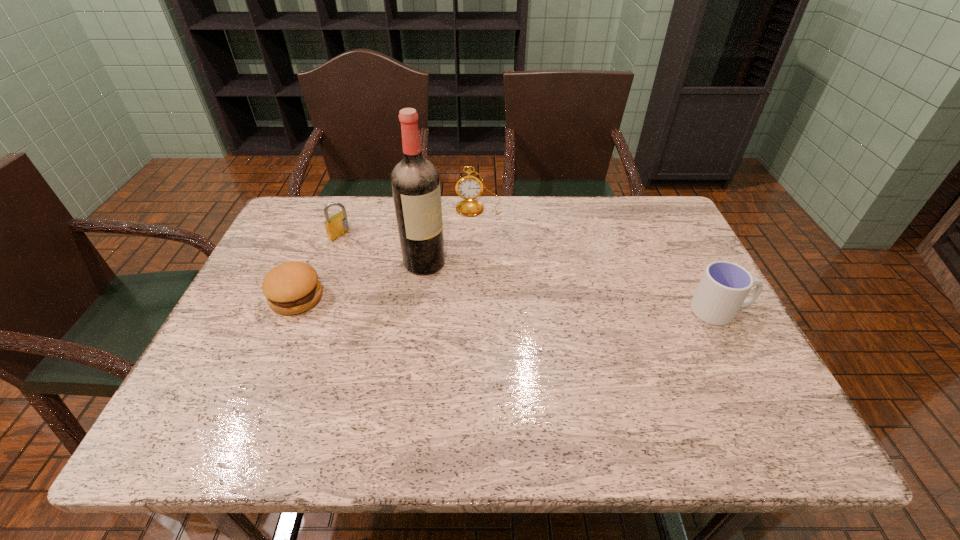
Find the location of `padlock located in the left edge section of the desktop`. padlock located in the left edge section of the desktop is located at coordinates click(337, 225).

Locate an element on the screen. The width and height of the screenshot is (960, 540). object at the right edge is located at coordinates (724, 286).

This screenshot has height=540, width=960. In order to click on object that is at the far left corner in this screenshot , I will do `click(337, 225)`.

You are a GUI agent. You are given a task and a screenshot of the screen. Output one action in this format:
    pyautogui.click(x=<x>, y=<y>)
    Task: Click on the free space at the far edge
    The width and height of the screenshot is (960, 540).
    Given the screenshot: What is the action you would take?
    pyautogui.click(x=450, y=199)

Where is `free location at the near edge of the desktop`? The height and width of the screenshot is (540, 960). free location at the near edge of the desktop is located at coordinates (493, 373).

This screenshot has height=540, width=960. In order to click on vacant space at the left edge of the desktop in this screenshot , I will do `click(252, 302)`.

I want to click on vacant point at the right edge, so [x=679, y=308].

At what (x,y) coordinates should I click in order to perform the action: click on vacant space at the far right corner. Please return your answer as a coordinate pair (x, y). This screenshot has width=960, height=540. Looking at the image, I should click on (633, 205).

What are the coordinates of `free space at the near right corner of the desktop` in the screenshot? It's located at (694, 369).

Where is `empty space that is in between the rightmost object and the fourth object from left to right`? The height and width of the screenshot is (540, 960). empty space that is in between the rightmost object and the fourth object from left to right is located at coordinates click(x=600, y=259).